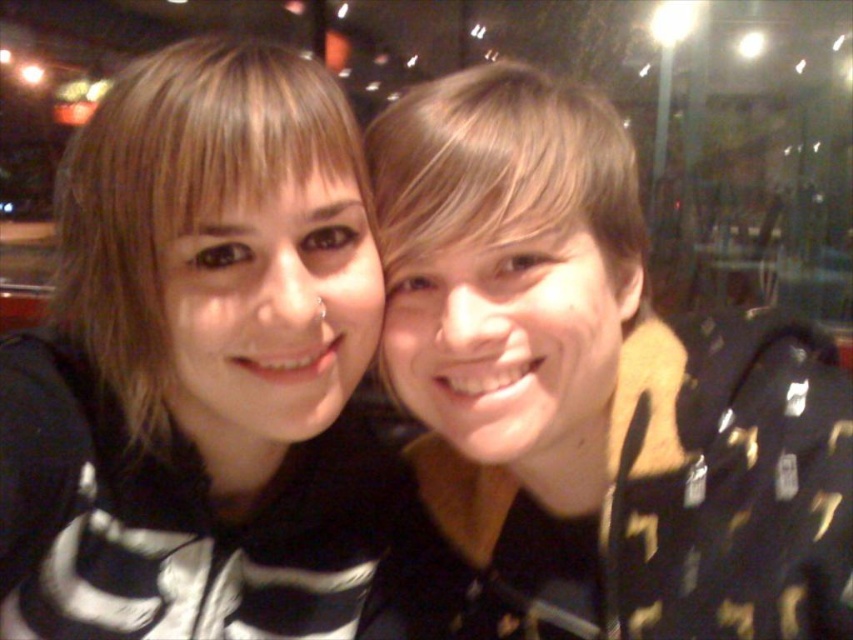
Does black matte jacket at right have a lesser height compared to black matte hoodie at center?

No.

Does black matte jacket at right appear under black matte hoodie at center?

Actually, black matte jacket at right is above black matte hoodie at center.

Describe the element at coordinates (595, 388) in the screenshot. I see `black matte jacket at right` at that location.

Where is `black matte jacket at right`? black matte jacket at right is located at coordinates (595, 388).